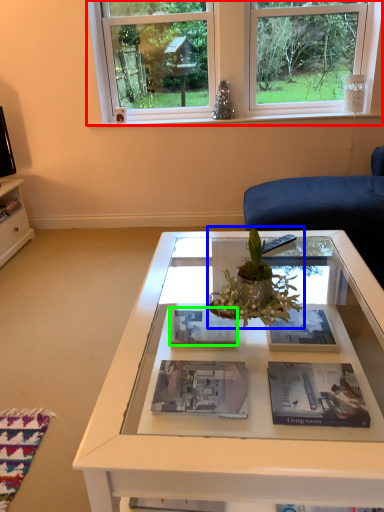
Question: Which object is the farthest from window (highlighted by a red box)? Choose among these: houseplant (highlighted by a blue box) or magazine (highlighted by a green box).

Choices:
 (A) houseplant
 (B) magazine

Answer: (A)